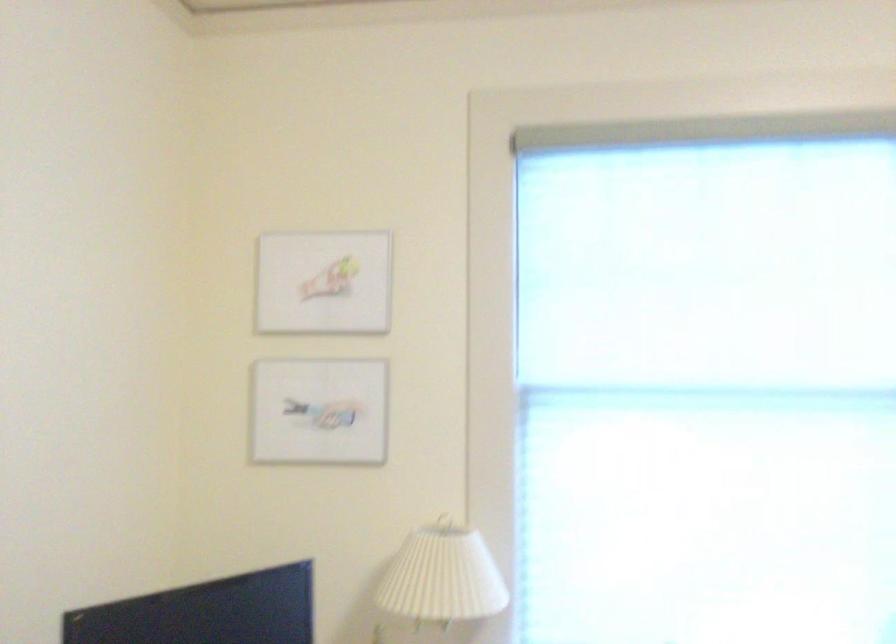
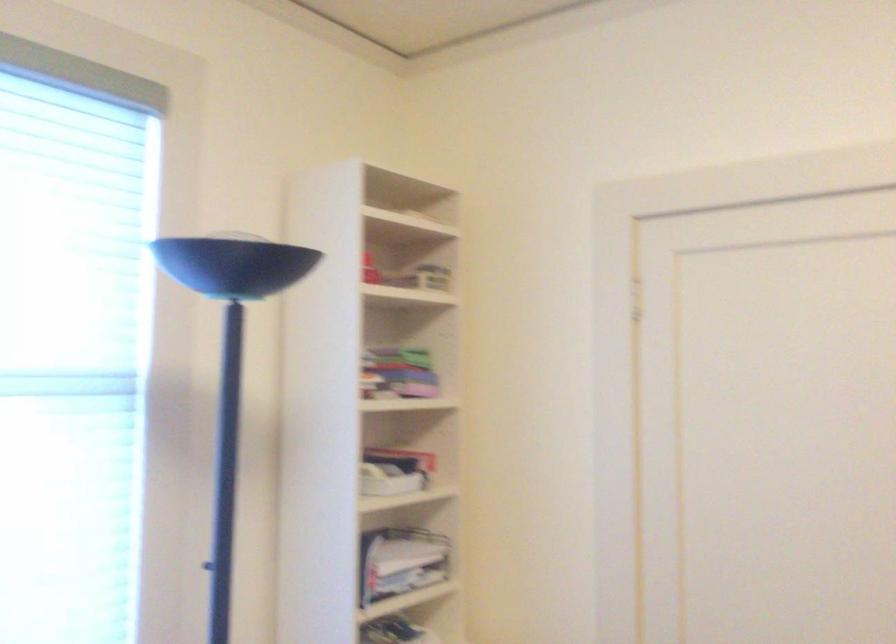
Question: The camera is either moving clockwise (left) or counter-clockwise (right) around the object. The first image is from the beginning of the video and the second image is from the end. Is the camera moving left or right when shooting the video?

Choices:
 (A) Left
 (B) Right

Answer: (A)